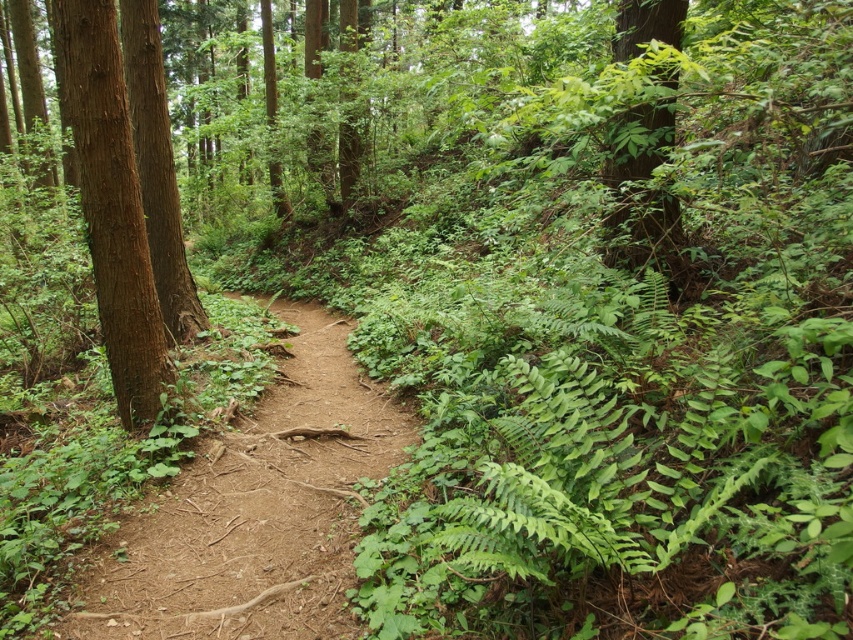
Looking at this image, you are a hiker navigating a narrow dirt path in the forest. You notice a brown rough bark tree at left. Based on its position, can you determine if the tree is closer to the path or further away from it?

The brown rough bark tree at left is located at point (111,204), which places it closer to the path compared to other elements in the scene, so it is closer to the path.

You are a hiker who wants to take a photo of both the brown rough tree at left and the green leafy tree at upper right. Since you have a camera with a fixed focal length, you need to position yourself so that both trees are in the frame. Based on their heights, which tree should you focus on to ensure both are visible?

The brown rough tree at left is taller than the green leafy tree at upper right. To ensure both are visible in the frame, you should focus on the brown rough tree at left and adjust your position so that the shorter green leafy tree at upper right remains within the camera view.

You are a hiker carrying a 2 meter long ladder. You need to place it between the brown rough bark tree at left and the green leafy tree at upper right. Is there enough space for the ladder to fit horizontally between them?

The distance between the brown rough bark tree at left and the green leafy tree at upper right is 3.46 meters. Since the ladder is 2 meters long, it will fit horizontally between them with 1.46 meters of space remaining.